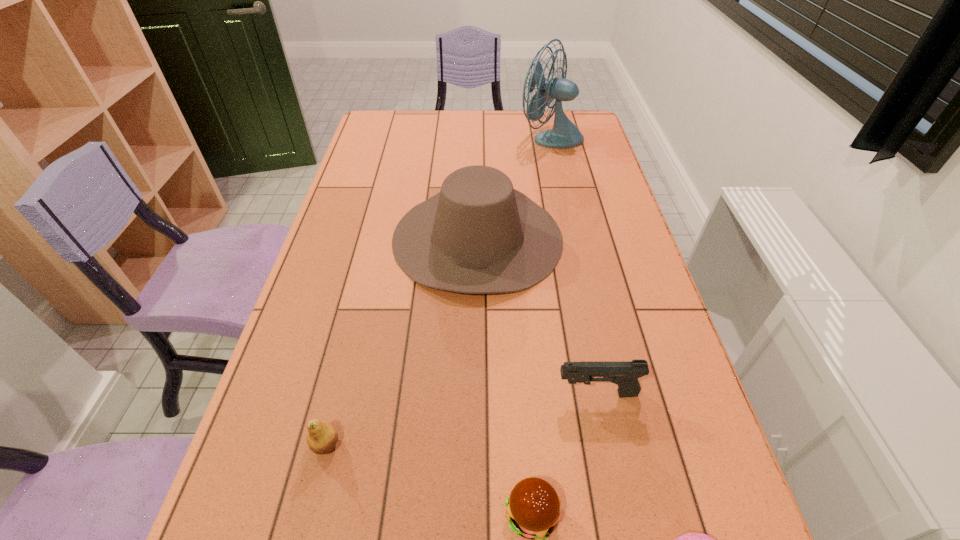
Find the location of a particular element. The image size is (960, 540). free spot located on the front of the fifth shortest object is located at coordinates (476, 457).

You are a GUI agent. You are given a task and a screenshot of the screen. Output one action in this format:
    pyautogui.click(x=<x>, y=<y>)
    Task: Click on the free space located on the right of the third nearest object
    The height and width of the screenshot is (540, 960).
    Given the screenshot: What is the action you would take?
    pyautogui.click(x=553, y=444)

You are a GUI agent. You are given a task and a screenshot of the screen. Output one action in this format:
    pyautogui.click(x=<x>, y=<y>)
    Task: Click on the free region located 0.240m at the barrel of the pistol
    
    Given the screenshot: What is the action you would take?
    (x=440, y=394)

Locate an element on the screen. This screenshot has height=540, width=960. vacant region located 0.220m at the barrel of the pistol is located at coordinates (449, 394).

This screenshot has width=960, height=540. What are the coordinates of `vacant space located at the barrel of the pistol` in the screenshot? It's located at (449, 394).

Where is `object present at the far edge`? The width and height of the screenshot is (960, 540). object present at the far edge is located at coordinates (564, 134).

In order to click on object positioned at the left edge in this screenshot , I will do `click(322, 437)`.

The width and height of the screenshot is (960, 540). I want to click on fan that is at the right edge, so click(564, 134).

Locate an element on the screen. The width and height of the screenshot is (960, 540). pistol that is at the right edge is located at coordinates (625, 374).

Find the location of a particular element. This screenshot has height=540, width=960. object that is positioned at the far right corner is located at coordinates (564, 134).